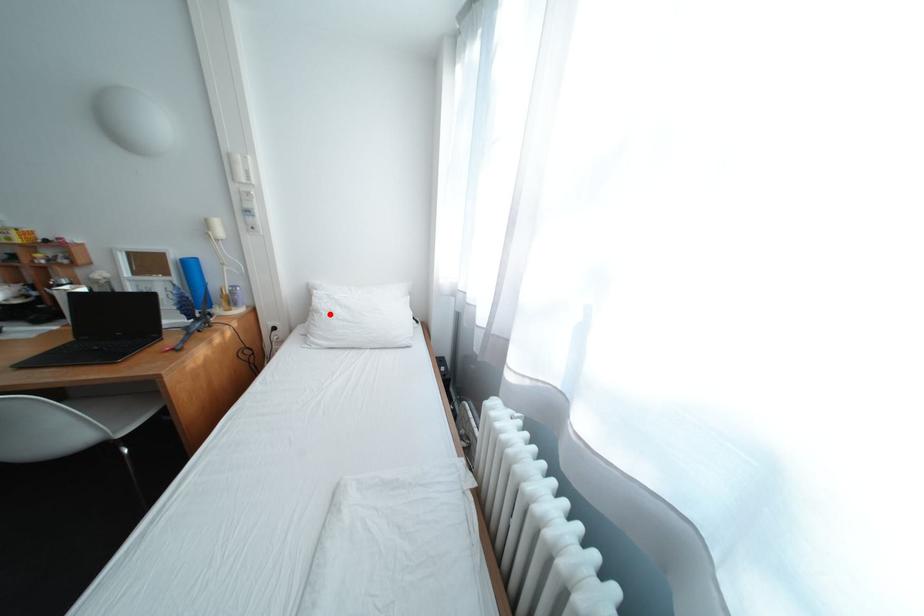
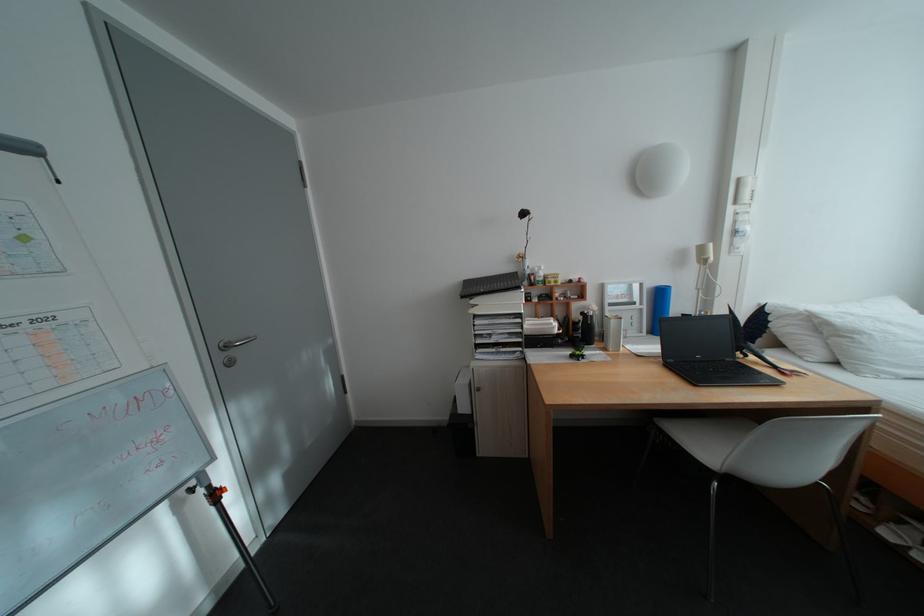
In the second image, find the point that corresponds to the highlighted location in the first image.

(871, 334)